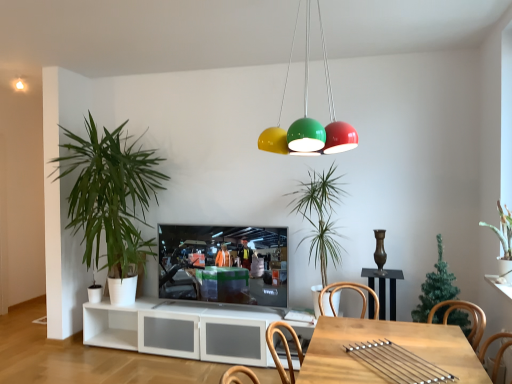
Question: From a real-world perspective, is matte black television at center physically below green matte christmas tree at center, which appears as the third houseplant when viewed from the left?

Choices:
 (A) no
 (B) yes

Answer: (B)

Question: Does matte black television at center have a greater width compared to green matte christmas tree at center, the 2th houseplant when ordered from right to left?

Choices:
 (A) yes
 (B) no

Answer: (B)

Question: Considering the relative positions of matte black television at center and green matte christmas tree at center, the 2th houseplant when ordered from right to left, in the image provided, is matte black television at center to the right of green matte christmas tree at center, the 2th houseplant when ordered from right to left, from the viewer's perspective?

Choices:
 (A) yes
 (B) no

Answer: (B)

Question: Can you confirm if matte black television at center is positioned to the left of green matte christmas tree at center, which appears as the third houseplant when viewed from the left?

Choices:
 (A) no
 (B) yes

Answer: (B)

Question: Is green matte christmas tree at center, which appears as the third houseplant when viewed from the left, at the back of matte black television at center?

Choices:
 (A) no
 (B) yes

Answer: (A)

Question: Considering their positions, is matte black television at center located in front of or behind light brown wooden table at lower center?

Choices:
 (A) front
 (B) behind

Answer: (B)

Question: From a real-world perspective, is matte black television at center physically located above or below light brown wooden table at lower center?

Choices:
 (A) above
 (B) below

Answer: (A)

Question: In terms of height, does matte black television at center look taller or shorter compared to light brown wooden table at lower center?

Choices:
 (A) short
 (B) tall

Answer: (B)

Question: Looking at the image, does matte black television at center seem bigger or smaller compared to light brown wooden table at lower center?

Choices:
 (A) small
 (B) big

Answer: (A)

Question: Relative to matte black television at center, is light brown wooden table at lower center in front or behind?

Choices:
 (A) front
 (B) behind

Answer: (A)

Question: In terms of height, does light brown wooden table at lower center look taller or shorter compared to matte black television at center?

Choices:
 (A) tall
 (B) short

Answer: (B)

Question: Is point (403, 380) positioned closer to the camera than point (200, 248)?

Choices:
 (A) closer
 (B) farther

Answer: (A)

Question: Considering the positions of light brown wooden table at lower center and matte black television at center in the image, is light brown wooden table at lower center bigger or smaller than matte black television at center?

Choices:
 (A) big
 (B) small

Answer: (A)

Question: From a real-world perspective, is green leafy plant at center, which is counted as the third houseplant, starting from the right, above or below green leafy plant at left, the 1th houseplant positioned from the left?

Choices:
 (A) above
 (B) below

Answer: (B)

Question: Looking at the image, does green leafy plant at center, placed as the 2th houseplant when sorted from left to right, seem bigger or smaller compared to green leafy plant at left, which is the fourth houseplant in right-to-left order?

Choices:
 (A) big
 (B) small

Answer: (B)